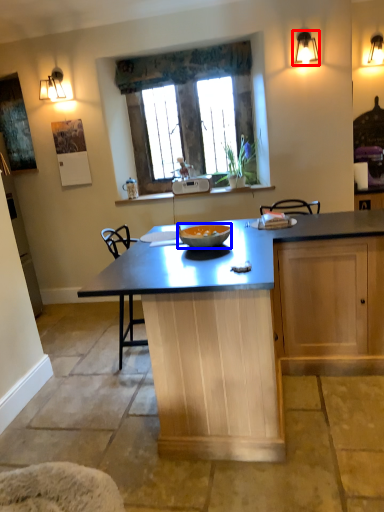
Question: Among these objects, which one is farthest to the camera, light fixture (highlighted by a red box) or glass bowl (highlighted by a blue box)?

Choices:
 (A) light fixture
 (B) glass bowl

Answer: (A)